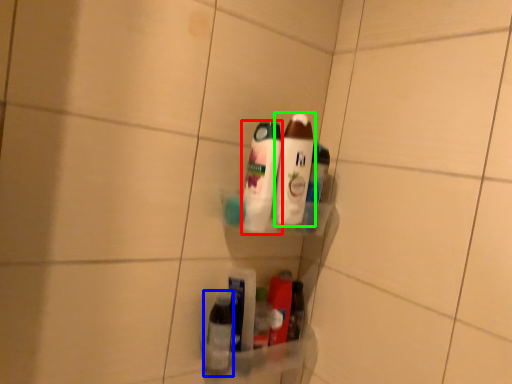
Question: Which object is positioned farthest from bottle (highlighted by a red box)? Select from bottle (highlighted by a blue box) and bottle (highlighted by a green box).

Choices:
 (A) bottle
 (B) bottle

Answer: (A)